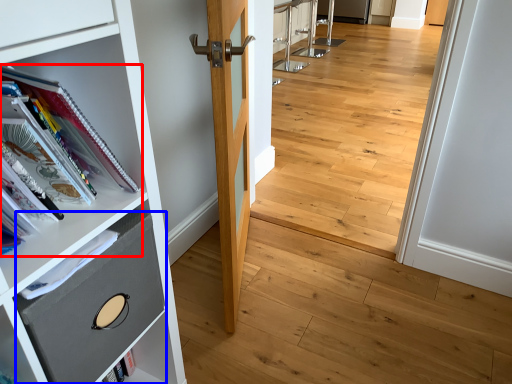
Question: Which object appears farthest to the camera in this image, book (highlighted by a red box) or drawer (highlighted by a blue box)?

Choices:
 (A) book
 (B) drawer

Answer: (B)